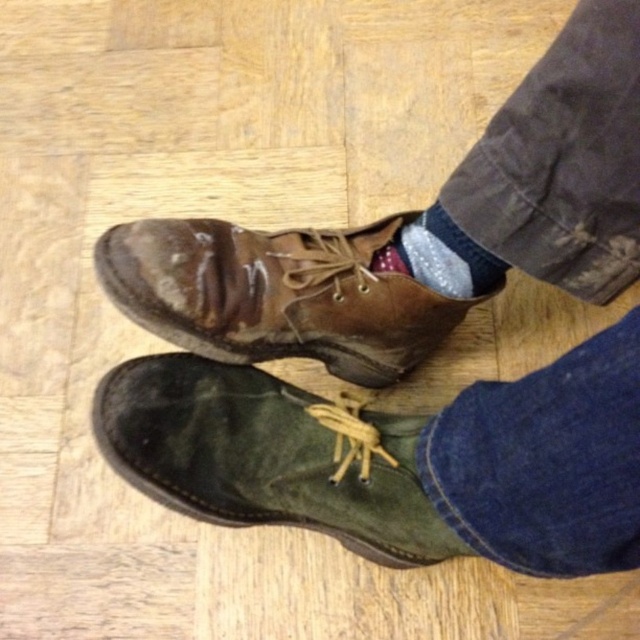
You are standing in a room and see the green suede boot at lower left and the brown suede boot at center. Which boot is closer to you?

The green suede boot at lower left is closer to you because it is in front of the brown suede boot at center.

Based on the scene description, where is the green suede boot at lower left located in 2D coordinates?

The green suede boot at lower left is located at point (268, 456) in 2D coordinates.